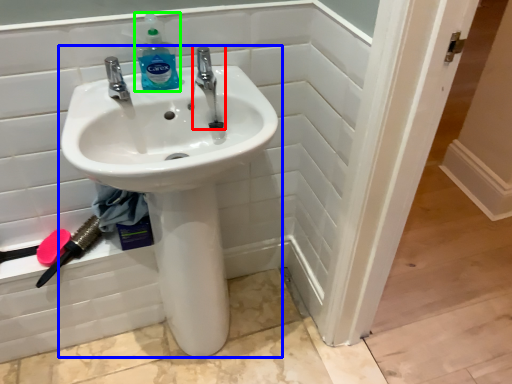
Question: Considering the real-world distances, which object is closest to tap (highlighted by a red box)? sink (highlighted by a blue box) or cleaning product (highlighted by a green box).

Choices:
 (A) sink
 (B) cleaning product

Answer: (B)